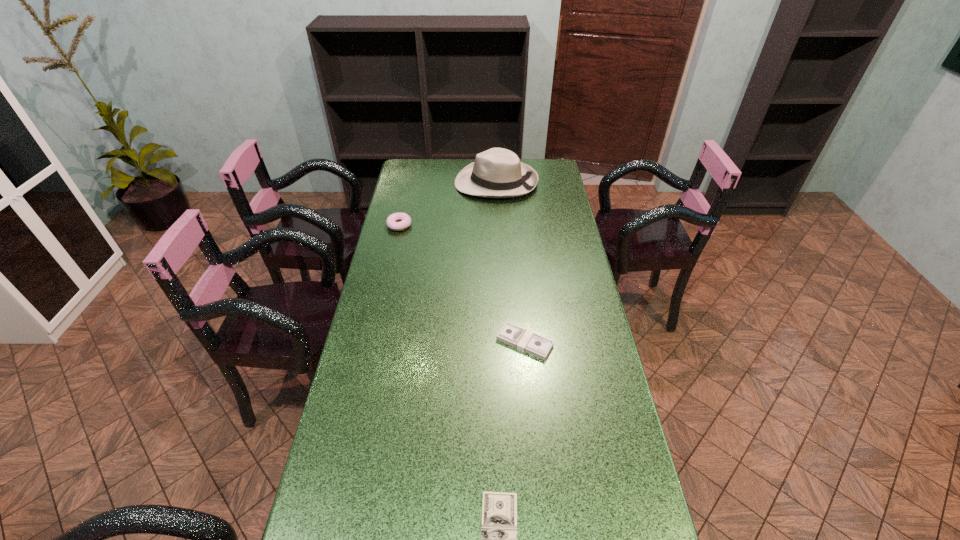
Find the location of a particular element. free space located on the back of the farther dollar is located at coordinates (521, 300).

Identify the location of object that is at the far edge. (496, 173).

This screenshot has height=540, width=960. Find the location of `object located in the left edge section of the desktop`. object located in the left edge section of the desktop is located at coordinates (405, 220).

Locate an element on the screen. fedora located in the right edge section of the desktop is located at coordinates (496, 173).

At what (x,y) coordinates should I click in order to perform the action: click on dollar located in the right edge section of the desktop. Please return your answer as a coordinate pair (x, y). Looking at the image, I should click on (513, 335).

This screenshot has width=960, height=540. I want to click on object that is at the far right corner, so click(496, 173).

In the image, there is a desktop. Identify the location of vacant space at the far edge. The image size is (960, 540). (456, 159).

You are a GUI agent. You are given a task and a screenshot of the screen. Output one action in this format:
    pyautogui.click(x=<x>, y=<y>)
    Task: Click on the free space at the left edge of the desktop
    
    Given the screenshot: What is the action you would take?
    pyautogui.click(x=381, y=348)

Where is `vacant space at the right edge of the desktop`? The width and height of the screenshot is (960, 540). vacant space at the right edge of the desktop is located at coordinates (558, 278).

At what (x,y) coordinates should I click in order to perform the action: click on vacant area at the far left corner. Please return your answer as a coordinate pair (x, y). Looking at the image, I should click on (400, 179).